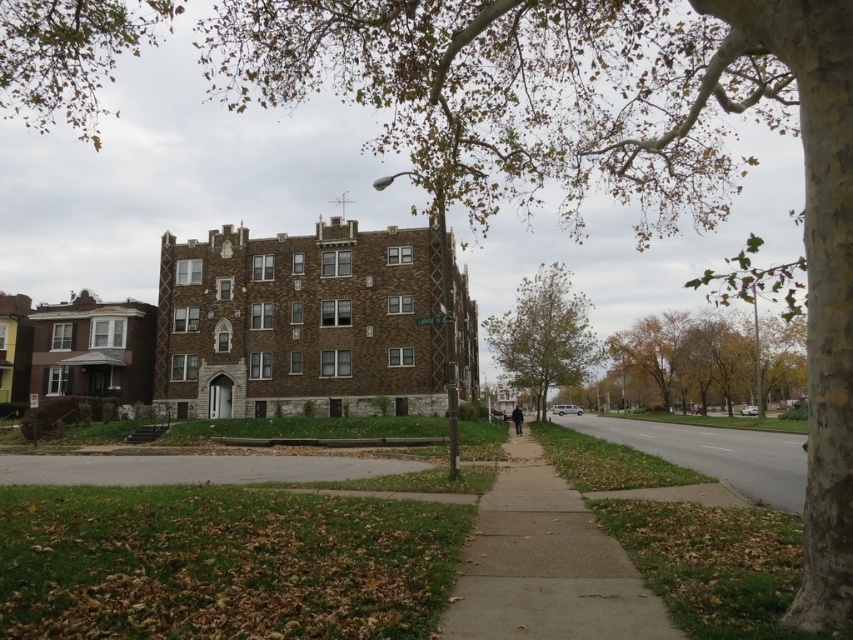
Is concrete sidewalk at center bigger than green leafy tree at center?

No, concrete sidewalk at center is not bigger than green leafy tree at center.

Does point (556, 611) lie behind point (515, 362)?

No, (556, 611) is in front of (515, 362).

Locate an element on the screen. The height and width of the screenshot is (640, 853). concrete sidewalk at center is located at coordinates point(546,564).

Can you confirm if concrete sidewalk at center is thinner than gray asphalt pavement at lower center?

Yes, concrete sidewalk at center is thinner than gray asphalt pavement at lower center.

Which of these two, concrete sidewalk at center or gray asphalt pavement at lower center, stands taller?

Standing taller between the two is concrete sidewalk at center.

The width and height of the screenshot is (853, 640). Find the location of `concrete sidewalk at center`. concrete sidewalk at center is located at coordinates (546, 564).

Is point (672, 387) in front of point (747, 436)?

That is False.

Which is behind, point (631, 397) or point (627, 438)?

The point (631, 397) is more distant.

Is point (676, 404) closer to viewer compared to point (674, 444)?

That is False.

The width and height of the screenshot is (853, 640). I want to click on yellow-green leaves at right, so click(x=705, y=362).